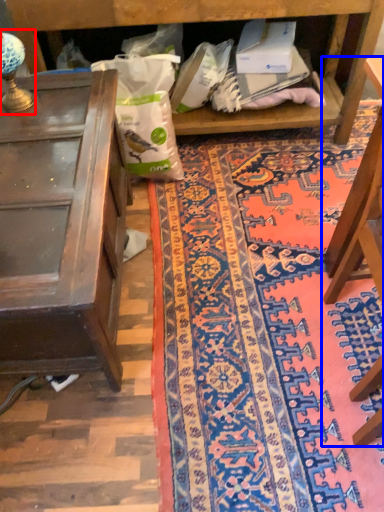
Question: Which object appears closest to the camera in this image, lamp (highlighted by a red box) or furniture (highlighted by a blue box)?

Choices:
 (A) lamp
 (B) furniture

Answer: (B)